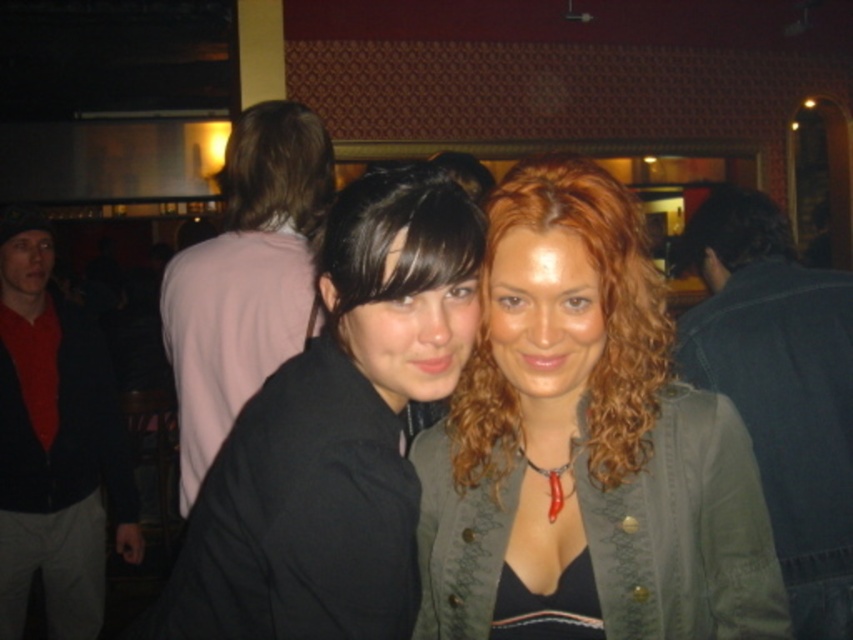
You are taking a photo of the two people in the image. The camera is focused on the point closer to you. Which point between point (36, 467) and point (213, 280) should you focus on to ensure the photo is clear?

You should focus on point (36, 467) because it is closer to you than point (213, 280), so focusing on it will ensure the photo is clear.

You are a photographer at a party and need to capture a group photo. You notice the red shirt at left and the pink fabric shirt at upper left. Which shirt should you adjust to ensure both are visible in the frame? Explain your reasoning.

The red shirt at left is narrower than the pink fabric shirt at upper left. Since the red shirt at left is smaller in width, you should adjust its position to ensure it doesn not get cut off or overshadowed by the larger pink fabric shirt at upper left, maintaining both in the frame.

From the picture: You are at a party and want to hang your jacket on a hook that can only hold jackets shorter than the denim jacket at right. Can you hang the matte green jacket at center on the hook?

The matte green jacket at center is shorter than the denim jacket at right, so yes, it can be hung on the hook since it meets the height requirement.